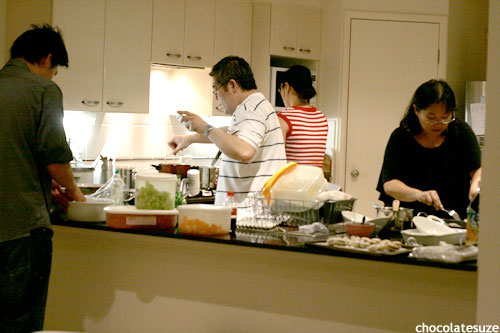
Find the location of a particular element. The image size is (500, 333). cooking pot is located at coordinates (172, 166), (208, 175).